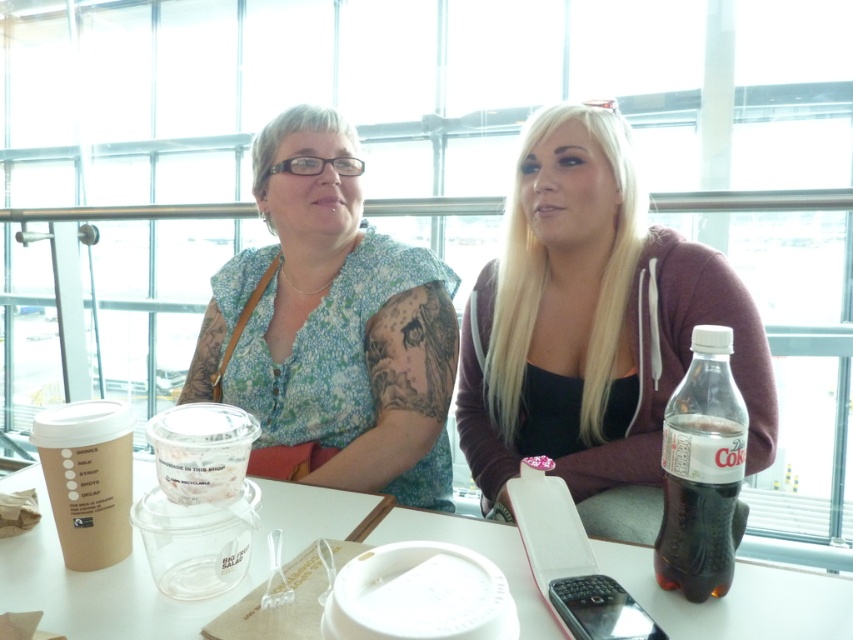
Question: Which object appears farthest from the camera in this image?

Choices:
 (A) clear plastic bottle at right
 (B) matte black hoodie at center
 (C) white plastic table at center

Answer: (B)

Question: Which of the following is the farthest from the observer?

Choices:
 (A) (347, 394)
 (B) (97, 488)
 (C) (610, 547)

Answer: (A)

Question: Is floral fabric blouse at center bigger than white plastic table at center?

Choices:
 (A) yes
 (B) no

Answer: (A)

Question: Based on their relative distances, which object is nearer to the floral fabric blouse at center?

Choices:
 (A) white plastic table at center
 (B) matte black hoodie at center
 (C) clear plastic bottle at right
 (D) brown paper cup at left

Answer: (B)

Question: Can you confirm if clear plastic bottle at right is thinner than brown paper cup at left?

Choices:
 (A) no
 (B) yes

Answer: (B)

Question: Is white plastic table at center positioned at the back of clear plastic bottle at right?

Choices:
 (A) yes
 (B) no

Answer: (B)